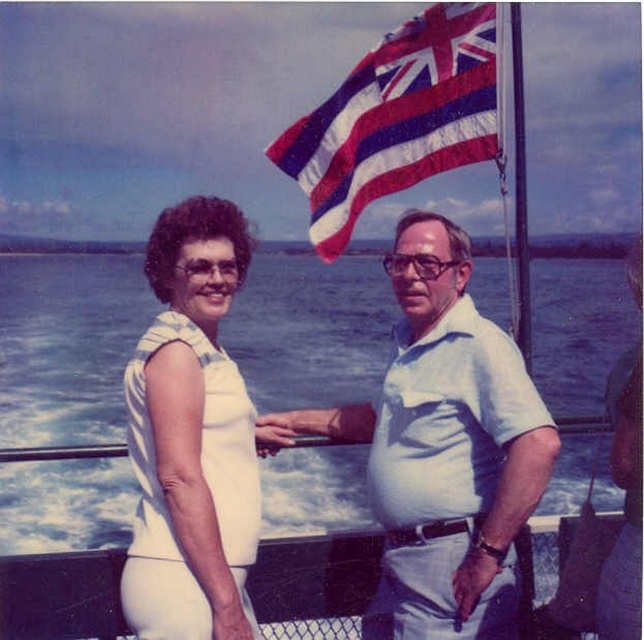
Is point (211, 275) positioned behind point (410, 145)?

No.

Looking at this image, is white fabric dress at left above textured fabric flag at upper center?

No, white fabric dress at left is not above textured fabric flag at upper center.

Find the location of a particular element. white fabric dress at left is located at coordinates (191, 436).

Who is positioned more to the left, white cotton shirt at center or textured fabric flag at upper center?

Positioned to the left is textured fabric flag at upper center.

Can you confirm if white cotton shirt at center is positioned above textured fabric flag at upper center?

No, white cotton shirt at center is not above textured fabric flag at upper center.

Is point (553, 438) positioned before point (386, 106)?

Yes, it is.

This screenshot has width=644, height=640. Find the location of `white cotton shirt at center`. white cotton shirt at center is located at coordinates (444, 449).

Is white cotton shirt at center smaller than white fabric dress at left?

Correct, white cotton shirt at center occupies less space than white fabric dress at left.

Which is below, white cotton shirt at center or white fabric dress at left?

Positioned lower is white fabric dress at left.

Describe the element at coordinates (444, 449) in the screenshot. I see `white cotton shirt at center` at that location.

Find the location of a particular element. The height and width of the screenshot is (640, 644). white cotton shirt at center is located at coordinates (444, 449).